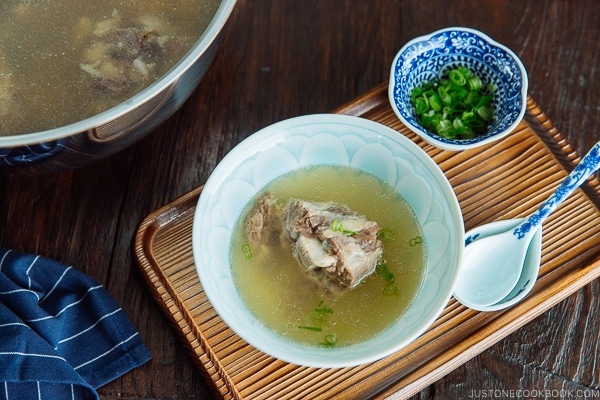
This screenshot has width=600, height=400. I want to click on wood tray, so click(527, 159).